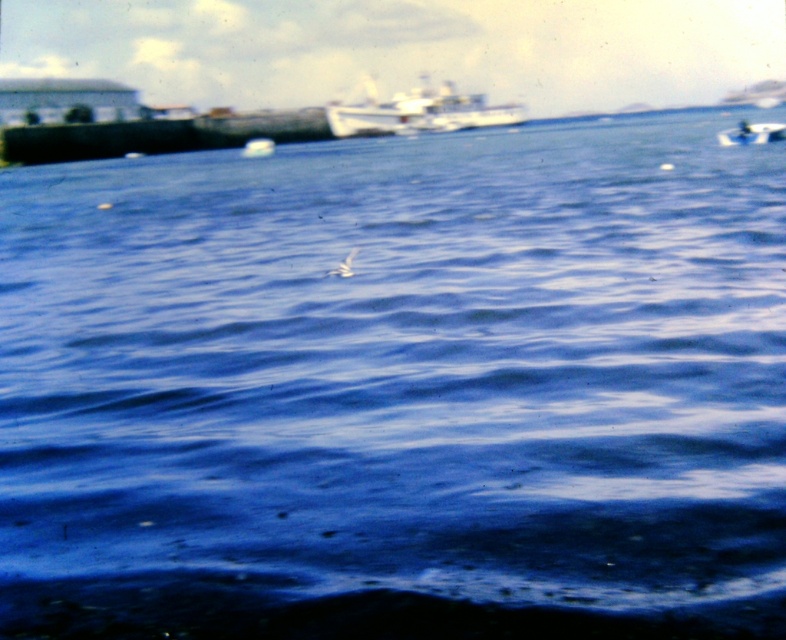
Question: Which point is farther to the camera?

Choices:
 (A) white matte bird at center
 (B) white plastic boat at upper right

Answer: (B)

Question: Which point is farther to the camera?

Choices:
 (A) (421, 81)
 (B) (351, 273)

Answer: (A)

Question: Is white matte boat at upper center positioned in front of white matte bird at center?

Choices:
 (A) yes
 (B) no

Answer: (B)

Question: Can you confirm if white matte boat at upper center is positioned above white matte bird at center?

Choices:
 (A) yes
 (B) no

Answer: (A)

Question: Can you confirm if white matte boat at upper center is bigger than white matte bird at center?

Choices:
 (A) yes
 (B) no

Answer: (A)

Question: Which point is closer to the camera taking this photo?

Choices:
 (A) (347, 268)
 (B) (516, 108)
 (C) (773, 138)

Answer: (A)